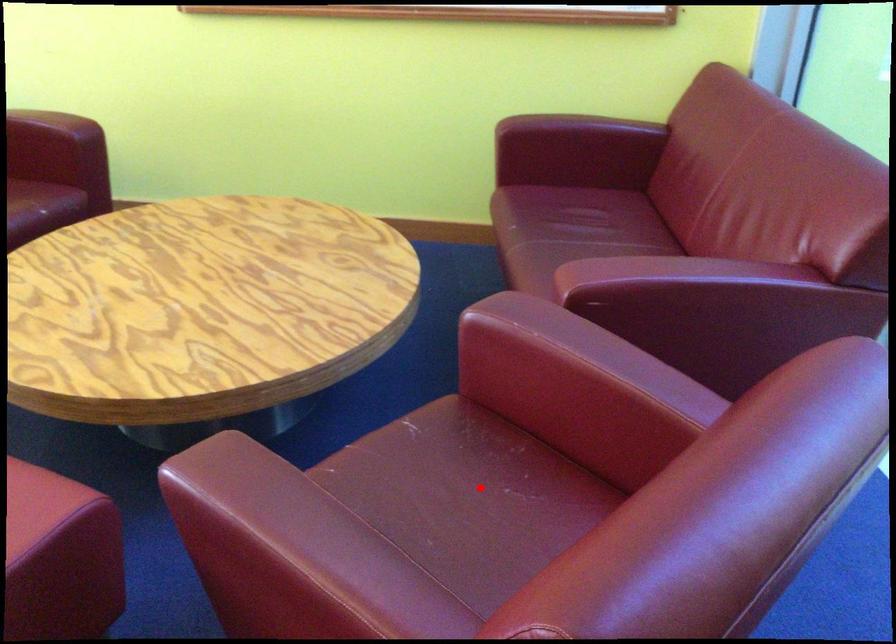
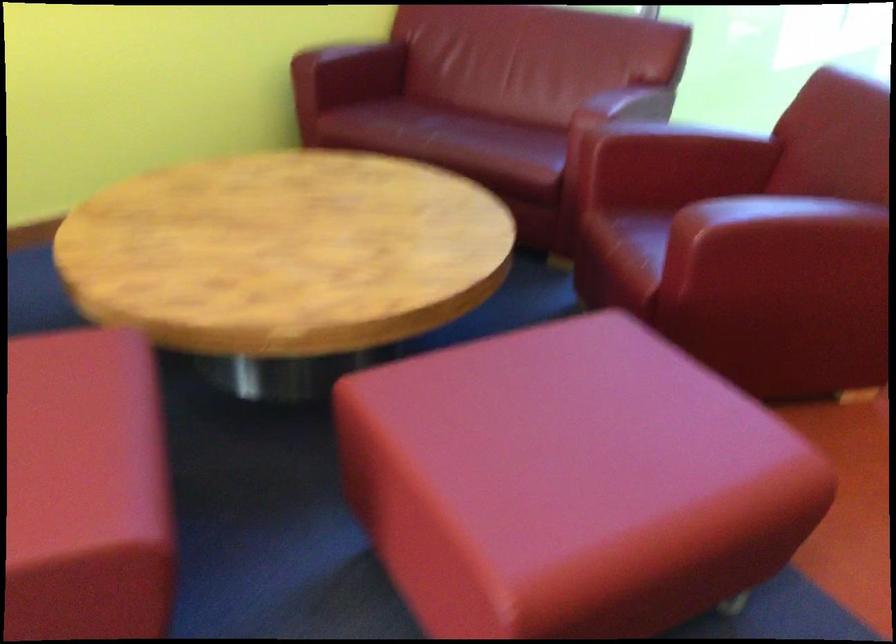
Question: I am providing you with two images of the same scene from different viewpoints. A red point is marked on the first image. Is the red point's position out of view in image 2?

Choices:
 (A) Yes
 (B) No

Answer: (A)